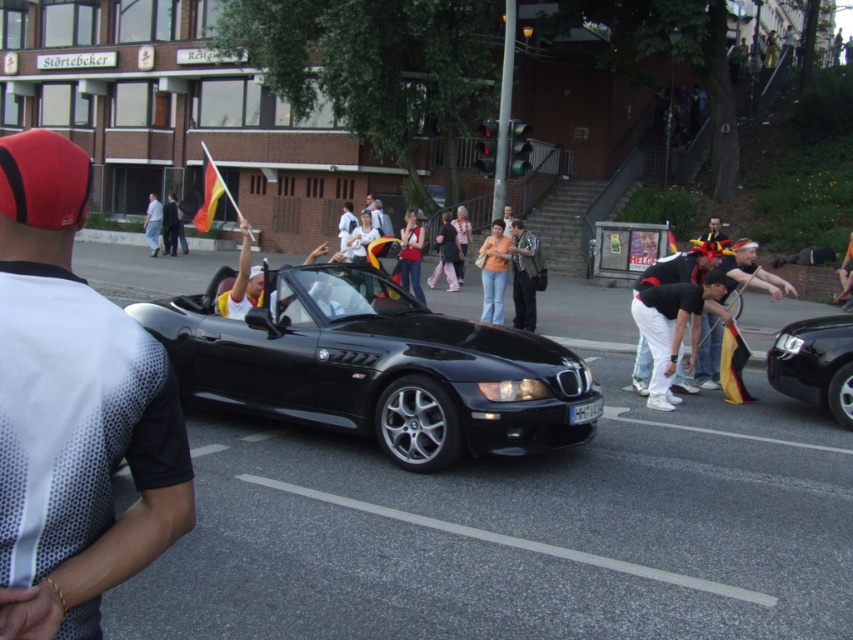
Question: Which object is positioned farthest from the matte orange shirt at center?

Choices:
 (A) white cotton pants at center
 (B) shiny black car at right
 (C) matte black convertible at center

Answer: (B)

Question: Which point appears farthest from the camera in this image?

Choices:
 (A) (842, 406)
 (B) (456, 253)

Answer: (B)

Question: Estimate the real-world distances between objects in this image. Which object is closer to the light pink fabric dress at center?

Choices:
 (A) yellow fabric flag at center
 (B) white cotton pants at center

Answer: (A)

Question: Is white cotton pants at center to the right of white cotton shirt at center from the viewer's perspective?

Choices:
 (A) no
 (B) yes

Answer: (B)

Question: Does matte orange shirt at center have a greater width compared to yellow-red-yellow fabric flag at upper left?

Choices:
 (A) no
 (B) yes

Answer: (A)

Question: Can you confirm if black metallic sports car at center is positioned above yellow fabric flag at center?

Choices:
 (A) yes
 (B) no

Answer: (A)